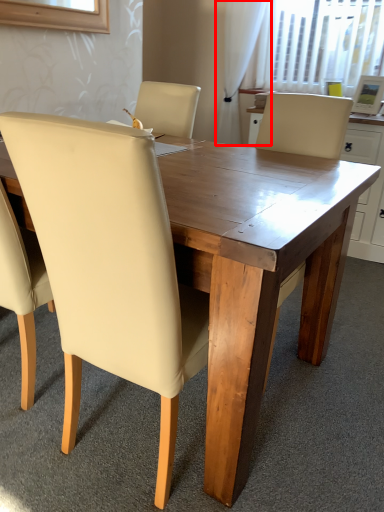
Question: Considering the relative positions of curtain (annotated by the red box) and chair in the image provided, where is curtain (annotated by the red box) located with respect to the staircase?

Choices:
 (A) right
 (B) left

Answer: (A)